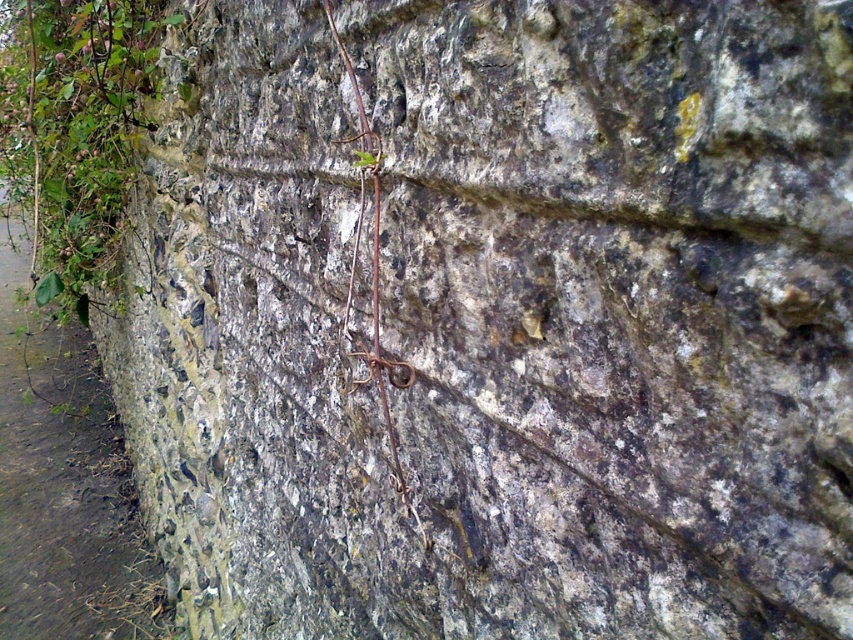
Question: Which point is closer to the camera taking this photo?

Choices:
 (A) (26, 248)
 (B) (397, 362)
 (C) (44, 68)

Answer: (B)

Question: Is green mossy stone at left in front of green leafy plant at left?

Choices:
 (A) no
 (B) yes

Answer: (A)

Question: Which object is the closest to the green leafy plant at left?

Choices:
 (A) brown rough vine at center
 (B) green mossy stone at left

Answer: (B)

Question: Which point is farther from the camera taking this photo?

Choices:
 (A) (376, 195)
 (B) (28, 504)

Answer: (B)

Question: Can you confirm if green leafy plant at left is smaller than brown rough vine at center?

Choices:
 (A) yes
 (B) no

Answer: (B)

Question: Is green mossy stone at left closer to the viewer compared to brown rough vine at center?

Choices:
 (A) no
 (B) yes

Answer: (A)